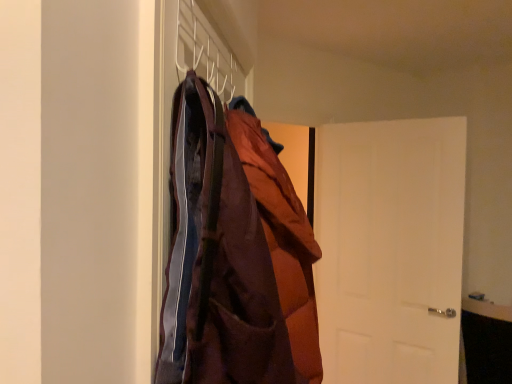
What is the approximate height of white matte coat hanger at upper center?

white matte coat hanger at upper center is 16.88 centimeters in height.

Measure the distance between point (288,290) and camera.

A distance of 33.03 inches exists between point (288,290) and camera.

Where is `white matte door at right`? The height and width of the screenshot is (384, 512). white matte door at right is located at coordinates (390, 249).

Find the location of a particular element. white matte coat hanger at upper center is located at coordinates (204, 51).

From the picture: Based on their sizes in the image, would you say white matte door at right is bigger or smaller than white matte coat hanger at upper center?

In the image, white matte door at right appears to be larger than white matte coat hanger at upper center.

Can you confirm if white matte door at right is wider than white matte coat hanger at upper center?

Correct, the width of white matte door at right exceeds that of white matte coat hanger at upper center.

Who is more distant, white matte door at right or white matte coat hanger at upper center?

white matte door at right is further away from the camera.

Is white matte door at right facing away from brown quilted jacket at center?

No, white matte door at right is not facing away from brown quilted jacket at center.

Is white matte door at right positioned behind brown quilted jacket at center?

Yes, white matte door at right is further from the camera.

Considering the positions of points (456, 284) and (237, 119), is point (456, 284) farther from camera compared to point (237, 119)?

Yes.

From the picture: Considering the sizes of objects white matte door at right and brown quilted jacket at center in the image provided, who is thinner, white matte door at right or brown quilted jacket at center?

white matte door at right.

Based on the photo, from a real-world perspective, is brown quilted jacket at center beneath white matte door at right?

No, from a real-world perspective, brown quilted jacket at center is not beneath white matte door at right.

Between brown quilted jacket at center and white matte door at right, which one has more height?

Standing taller between the two is white matte door at right.

Considering the relative sizes of brown quilted jacket at center and white matte door at right in the image provided, is brown quilted jacket at center bigger than white matte door at right?

Incorrect, brown quilted jacket at center is not larger than white matte door at right.

In the scene shown: Is brown quilted jacket at center inside the boundaries of white matte door at right, or outside?

brown quilted jacket at center is located beyond the bounds of white matte door at right.

Is point (304, 295) less distant than point (179, 13)?

No, (304, 295) is further to viewer.

This screenshot has height=384, width=512. Identify the location of hanger located in front of the brown quilted jacket at center. (204, 51).

From a real-world perspective, is brown quilted jacket at center positioned above or below white matte coat hanger at upper center?

Clearly, from a real-world perspective, brown quilted jacket at center is below white matte coat hanger at upper center.

Can you confirm if brown quilted jacket at center is positioned to the right of white matte coat hanger at upper center?

Indeed, brown quilted jacket at center is positioned on the right side of white matte coat hanger at upper center.

Locate an element on the screen. This screenshot has height=384, width=512. door behind the white matte coat hanger at upper center is located at coordinates (390, 249).

Can you confirm if white matte coat hanger at upper center is thinner than white matte door at right?

Indeed, white matte coat hanger at upper center has a lesser width compared to white matte door at right.

Measure the distance from white matte coat hanger at upper center to white matte door at right.

white matte coat hanger at upper center is 1.58 meters away from white matte door at right.

From the image's perspective, which one is positioned higher, white matte coat hanger at upper center or white matte door at right?

white matte coat hanger at upper center.

The image size is (512, 384). In order to click on cloak located behind the white matte coat hanger at upper center in this screenshot , I will do `click(281, 234)`.

From the image's perspective, which one is positioned lower, white matte coat hanger at upper center or brown quilted jacket at center?

brown quilted jacket at center.

Find the location of `door below the white matte coat hanger at upper center (from the image's perspective)`. door below the white matte coat hanger at upper center (from the image's perspective) is located at coordinates (390, 249).

Locate an element on the screen. The height and width of the screenshot is (384, 512). cloak located on the left of white matte door at right is located at coordinates (281, 234).

When comparing their distances from brown quilted jacket at center, does white matte door at right or white matte coat hanger at upper center seem closer?

white matte coat hanger at upper center is closer to brown quilted jacket at center.

In the scene shown: From the image, which object appears to be farther from brown quilted jacket at center, white matte coat hanger at upper center or white matte door at right?

Among the two, white matte door at right is located further to brown quilted jacket at center.

Considering their positions, is brown quilted jacket at center positioned further to white matte coat hanger at upper center than white matte door at right?

white matte door at right is further to white matte coat hanger at upper center.

Which object lies nearer to the anchor point white matte door at right, brown quilted jacket at center or white matte coat hanger at upper center?

brown quilted jacket at center is positioned closer to the anchor white matte door at right.

From the image, which object appears to be farther from white matte door at right, white matte coat hanger at upper center or brown quilted jacket at center?

The object further to white matte door at right is white matte coat hanger at upper center.

Estimate the real-world distances between objects in this image. Which object is closer to white matte coat hanger at upper center, white matte door at right or brown quilted jacket at center?

Among the two, brown quilted jacket at center is located nearer to white matte coat hanger at upper center.

Where is `cloak located between white matte coat hanger at upper center and white matte door at right in the depth direction`? This screenshot has height=384, width=512. cloak located between white matte coat hanger at upper center and white matte door at right in the depth direction is located at coordinates (281, 234).